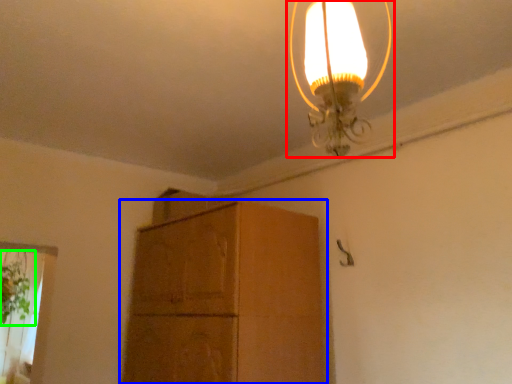
Question: Considering the real-world distances, which object is farthest from lamp (highlighted by a red box)? cabinetry (highlighted by a blue box) or plant (highlighted by a green box)?

Choices:
 (A) cabinetry
 (B) plant

Answer: (B)